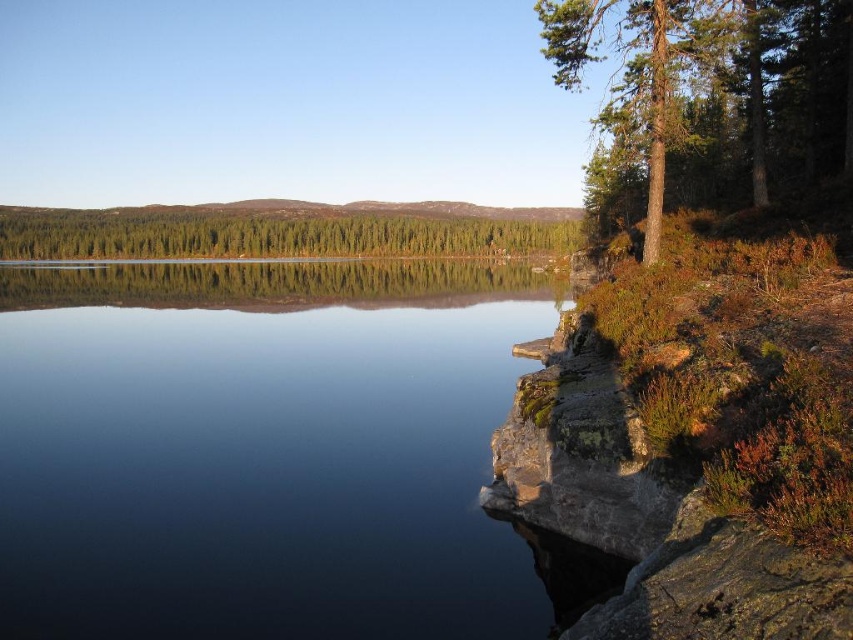
Does transparent glass water at center appear on the left side of green textured tree at upper right?

Correct, you'll find transparent glass water at center to the left of green textured tree at upper right.

Does transparent glass water at center come in front of green textured tree at upper right?

Yes, transparent glass water at center is in front of green textured tree at upper right.

Who is more forward, (231, 376) or (724, 64)?

Positioned in front is point (231, 376).

Identify the location of transparent glass water at center. (260, 451).

In order to click on transparent glass water at center in this screenshot , I will do `click(260, 451)`.

Can you confirm if transparent glass water at center is shorter than green matte trees at center?

Yes.

Who is more forward, (234, 516) or (296, 214)?

Point (234, 516)

At what (x,y) coordinates should I click in order to perform the action: click on transparent glass water at center. Please return your answer as a coordinate pair (x, y). Looking at the image, I should click on (260, 451).

Does green textured tree at upper right have a larger size compared to green matte trees at center?

Correct, green textured tree at upper right is larger in size than green matte trees at center.

Is green textured tree at upper right positioned at the back of green matte trees at center?

No, green textured tree at upper right is closer to the viewer.

At what (x,y) coordinates should I click in order to perform the action: click on green textured tree at upper right. Please return your answer as a coordinate pair (x, y). This screenshot has width=853, height=640. Looking at the image, I should click on (706, 99).